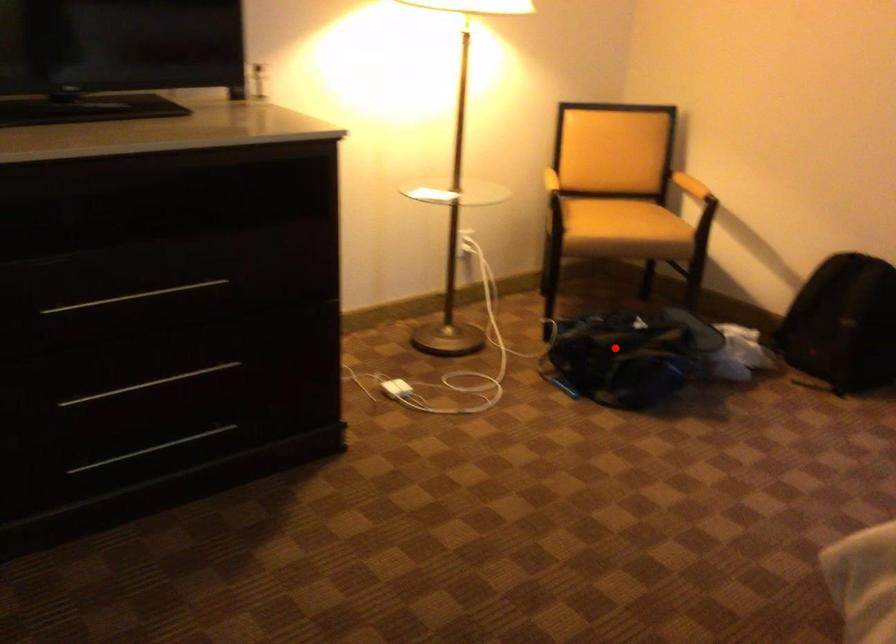
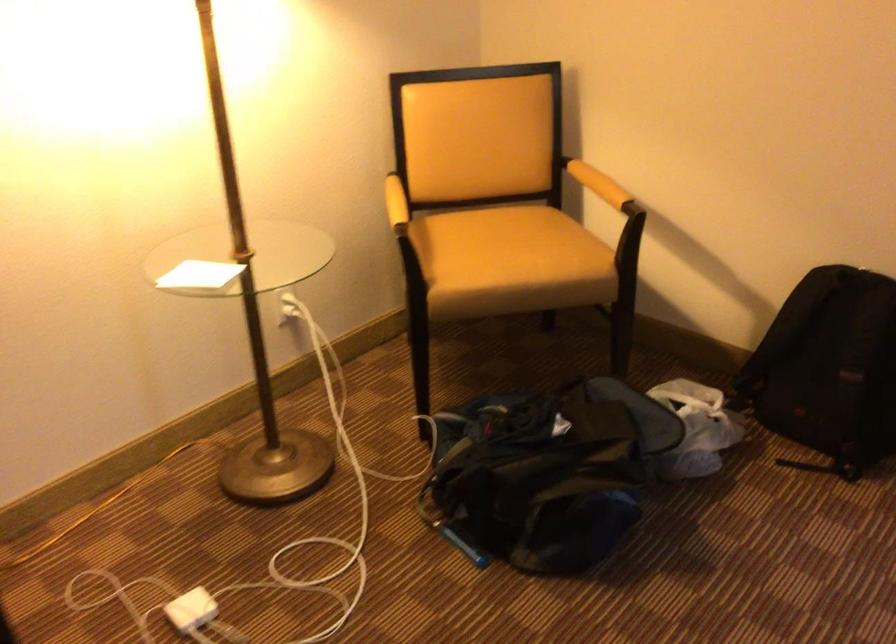
Find the pixel in the second image that matches the highlighted location in the first image.

(537, 480)